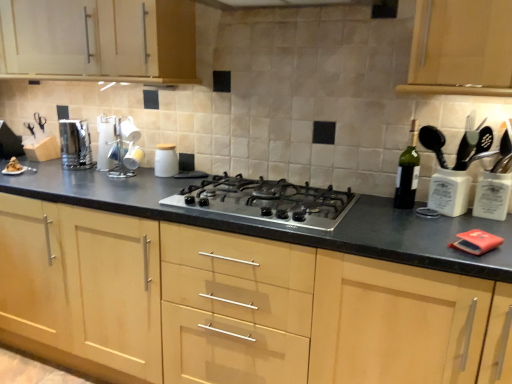
This screenshot has height=384, width=512. What are the coordinates of `vacant space in front of green glass bottle at right` in the screenshot? It's located at (425, 221).